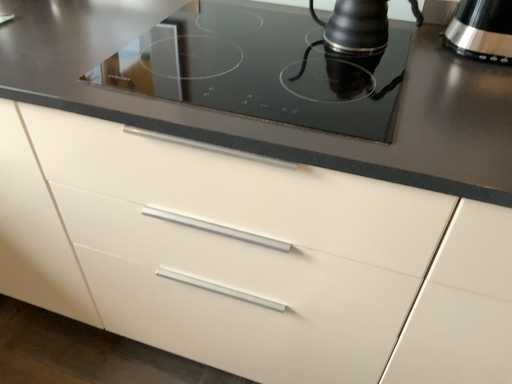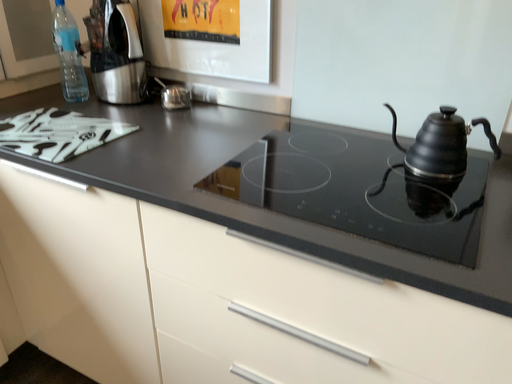
Question: Which way did the camera rotate in the video?

Choices:
 (A) rotated right
 (B) rotated left

Answer: (B)